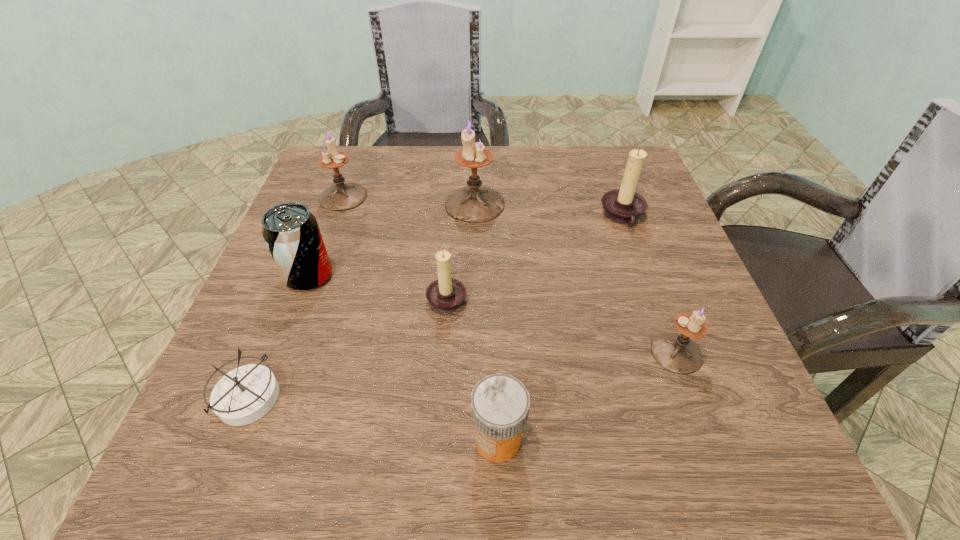
Find the location of a particular element. This screenshot has height=540, width=960. the tallest object is located at coordinates (474, 204).

Where is `the second purple candle holder from left to right`? the second purple candle holder from left to right is located at coordinates (474, 204).

Locate an element on the screen. the leftmost candle holder is located at coordinates (341, 196).

The image size is (960, 540). I want to click on the second biggest purple candle holder, so click(341, 196).

This screenshot has width=960, height=540. I want to click on the right brown candle holder, so click(624, 206).

Find the location of a particular element. The height and width of the screenshot is (540, 960). the bigger brown candle holder is located at coordinates click(x=624, y=206).

This screenshot has height=540, width=960. I want to click on soda can, so click(x=291, y=232).

The image size is (960, 540). In order to click on the smallest purple candle holder in this screenshot , I will do `click(677, 353)`.

Where is `the nearest candle holder`? This screenshot has width=960, height=540. the nearest candle holder is located at coordinates (677, 353).

Where is `the left brown candle holder`? This screenshot has height=540, width=960. the left brown candle holder is located at coordinates (446, 294).